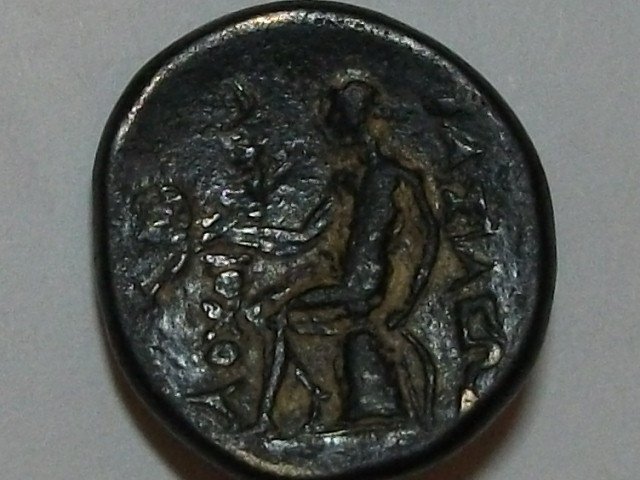
Where is `engraved stool`? This screenshot has width=640, height=480. engraved stool is located at coordinates (361, 371).